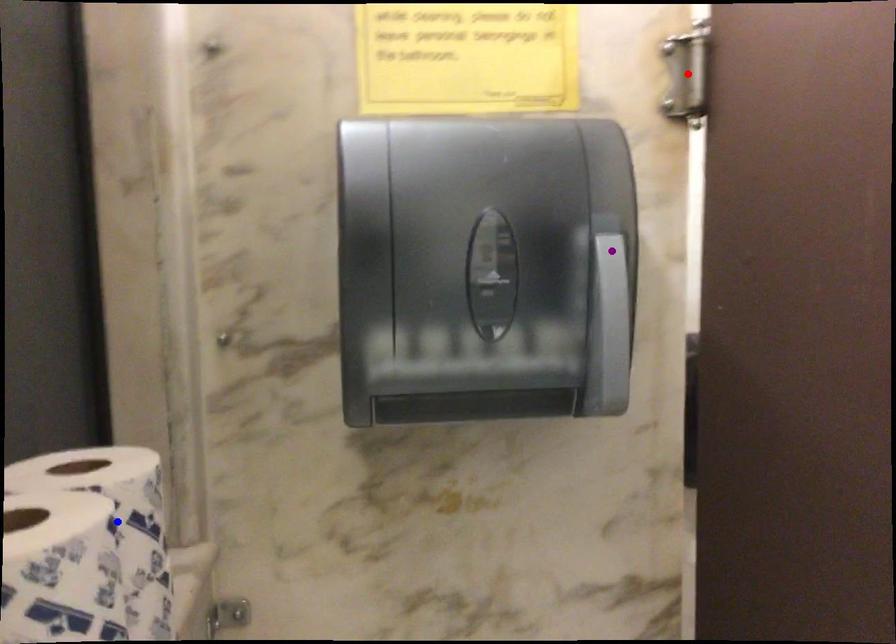
Order these from farthest to nearest:
A) blue point
B) red point
C) purple point

red point, purple point, blue point